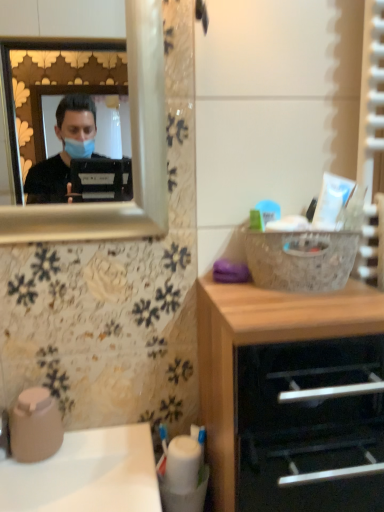
Locate an element on the screen. white glossy sink at lower left is located at coordinates (87, 474).

What do you see at coordinates (87, 474) in the screenshot?
I see `white glossy sink at lower left` at bounding box center [87, 474].

Measure the distance between point (131, 446) and camera.

They are 33.62 inches apart.

What do you see at coordinates (262, 343) in the screenshot? I see `wooden chest of drawers at lower right` at bounding box center [262, 343].

Looking at this image, what is the approximate height of wooden chest of drawers at lower right?

wooden chest of drawers at lower right is 62.73 centimeters in height.

I want to click on wooden chest of drawers at lower right, so click(x=262, y=343).

Find the location of a particular element. white glossy sink at lower left is located at coordinates pos(87,474).

Which object is positioned more to the right, white glossy sink at lower left or wooden chest of drawers at lower right?

wooden chest of drawers at lower right is more to the right.

Considering their positions, is white glossy sink at lower left located in front of or behind wooden chest of drawers at lower right?

In the image, white glossy sink at lower left appears behind wooden chest of drawers at lower right.

Considering the positions of point (102, 464) and point (315, 316), is point (102, 464) closer or farther from the camera than point (315, 316)?

Point (102, 464) is positioned farther from the camera compared to point (315, 316).

From the image's perspective, which one is positioned higher, white glossy sink at lower left or wooden chest of drawers at lower right?

From the image's view, wooden chest of drawers at lower right is above.

From a real-world perspective, is white glossy sink at lower left above or below wooden chest of drawers at lower right?

white glossy sink at lower left is situated lower than wooden chest of drawers at lower right in the real world.

Considering the relative sizes of white glossy sink at lower left and wooden chest of drawers at lower right in the image provided, is white glossy sink at lower left wider than wooden chest of drawers at lower right?

In fact, white glossy sink at lower left might be narrower than wooden chest of drawers at lower right.

From their relative heights in the image, would you say white glossy sink at lower left is taller or shorter than wooden chest of drawers at lower right?

In the image, white glossy sink at lower left appears to be shorter than wooden chest of drawers at lower right.

Which of these two, white glossy sink at lower left or wooden chest of drawers at lower right, is smaller?

Smaller between the two is white glossy sink at lower left.

Is white glossy sink at lower left completely or partially outside of wooden chest of drawers at lower right?

Absolutely, white glossy sink at lower left is external to wooden chest of drawers at lower right.

Is white glossy sink at lower left positioned far away from wooden chest of drawers at lower right?

No, white glossy sink at lower left is in close proximity to wooden chest of drawers at lower right.

Is white glossy sink at lower left oriented towards wooden chest of drawers at lower right?

No, white glossy sink at lower left is not oriented towards wooden chest of drawers at lower right.

Can you tell me how much white glossy sink at lower left and wooden chest of drawers at lower right differ in facing direction?

There is a 0.328-degree angle between the facing directions of white glossy sink at lower left and wooden chest of drawers at lower right.

The height and width of the screenshot is (512, 384). I want to click on the chest of drawers located above the white glossy sink at lower left (from the image's perspective), so click(262, 343).

Does wooden chest of drawers at lower right appear on the left side of white glossy sink at lower left?

No.

Is wooden chest of drawers at lower right positioned behind white glossy sink at lower left?

No, the depth of wooden chest of drawers at lower right is less than that of white glossy sink at lower left.

Is point (218, 301) closer or farther from the camera than point (111, 465)?

Point (218, 301) is closer to the camera than point (111, 465).

From the image's perspective, is wooden chest of drawers at lower right located beneath white glossy sink at lower left?

Incorrect, from the image's perspective, wooden chest of drawers at lower right is higher than white glossy sink at lower left.

From a real-world perspective, is wooden chest of drawers at lower right over white glossy sink at lower left?

Yes.

Between wooden chest of drawers at lower right and white glossy sink at lower left, which one has smaller width?

white glossy sink at lower left.

Between wooden chest of drawers at lower right and white glossy sink at lower left, which one has more height?

wooden chest of drawers at lower right is taller.

Based on their sizes in the image, would you say wooden chest of drawers at lower right is bigger or smaller than white glossy sink at lower left?

wooden chest of drawers at lower right is bigger than white glossy sink at lower left.

Is wooden chest of drawers at lower right inside the boundaries of white glossy sink at lower left, or outside?

wooden chest of drawers at lower right is located beyond the bounds of white glossy sink at lower left.

Are wooden chest of drawers at lower right and white glossy sink at lower left beside each other?

wooden chest of drawers at lower right and white glossy sink at lower left are clearly separated.

Is wooden chest of drawers at lower right looking in the opposite direction of white glossy sink at lower left?

No, wooden chest of drawers at lower right is not facing the opposite direction of white glossy sink at lower left.

Looking at this image, what's the angular difference between wooden chest of drawers at lower right and white glossy sink at lower left's facing directions?

wooden chest of drawers at lower right and white glossy sink at lower left are facing 0.328 degrees away from each other.

How far apart are wooden chest of drawers at lower right and white glossy sink at lower left?

wooden chest of drawers at lower right is 11.16 inches from white glossy sink at lower left.

Find the location of a particular element. The image size is (384, 512). sink behind the wooden chest of drawers at lower right is located at coordinates (87, 474).

Locate an element on the screen. This screenshot has width=384, height=512. the chest of drawers that is in front of the white glossy sink at lower left is located at coordinates (262, 343).

This screenshot has height=512, width=384. Find the location of `chest of drawers above the white glossy sink at lower left (from a real-world perspective)`. chest of drawers above the white glossy sink at lower left (from a real-world perspective) is located at coordinates (262, 343).